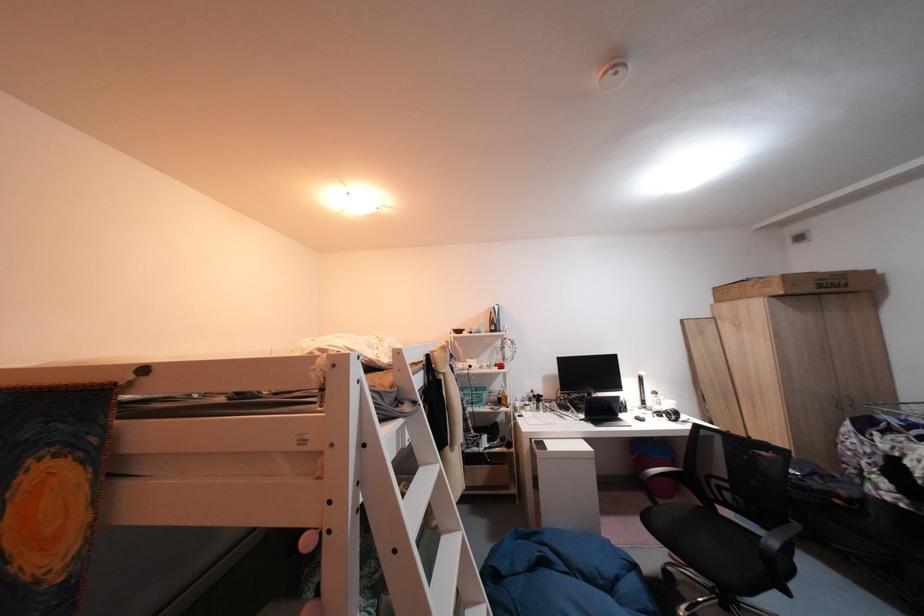
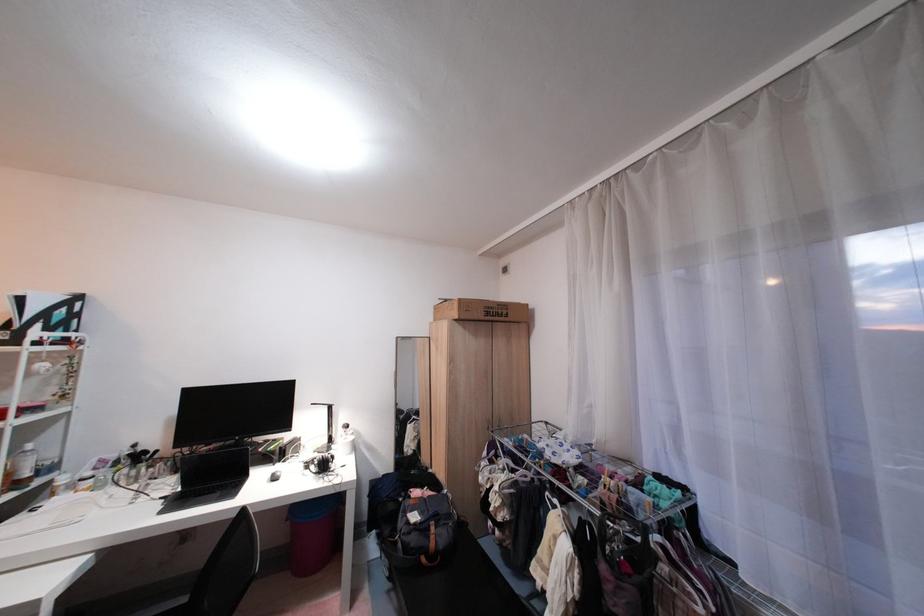
Locate, in the second image, the point that corresponds to (x=591, y=421) in the first image.

(172, 500)